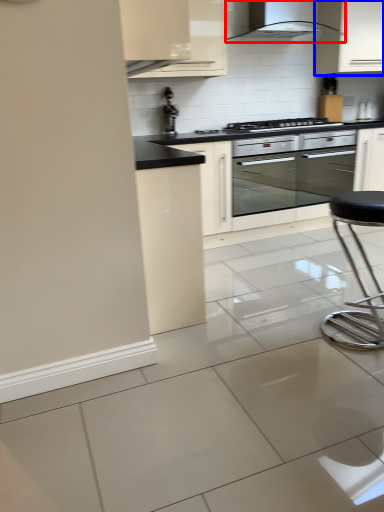
Question: Which of the following is the farthest to the observer, home appliance (highlighted by a red box) or cabinetry (highlighted by a blue box)?

Choices:
 (A) home appliance
 (B) cabinetry

Answer: (B)